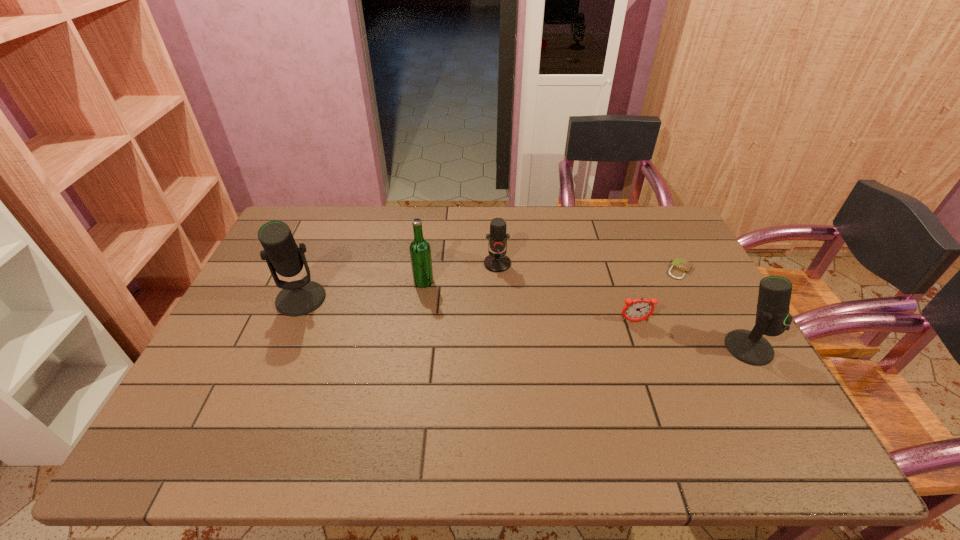
Where is `vacant space located on the right of the second nearest microphone`? This screenshot has height=540, width=960. vacant space located on the right of the second nearest microphone is located at coordinates (442, 299).

This screenshot has height=540, width=960. Identify the location of free region located on the back of the second shortest microphone. (705, 270).

At what (x,y) coordinates should I click in order to perform the action: click on free space located on the front-facing side of the second nearest object. Please return your answer as a coordinate pair (x, y). Image resolution: width=960 pixels, height=540 pixels. Looking at the image, I should click on (661, 396).

Locate an element on the screen. free space located 0.110m on the back of the fifth object from right to left is located at coordinates (428, 253).

This screenshot has height=540, width=960. In order to click on vacant space situated 0.220m on the side of the second microphone from right to left with the red ring in this screenshot , I will do pos(500,326).

The height and width of the screenshot is (540, 960). I want to click on blank space located on the back of the shortest object, so click(669, 248).

This screenshot has height=540, width=960. What are the coordinates of `object present at the left edge` in the screenshot? It's located at (300, 297).

Locate an element on the screen. microphone that is positioned at the right edge is located at coordinates (772, 316).

At what (x,y) coordinates should I click in order to perform the action: click on padlock present at the right edge. Please return your answer as a coordinate pair (x, y). The image size is (960, 540). Looking at the image, I should click on (678, 264).

Find the location of `vacant space at the far edge of the desktop`. vacant space at the far edge of the desktop is located at coordinates (541, 216).